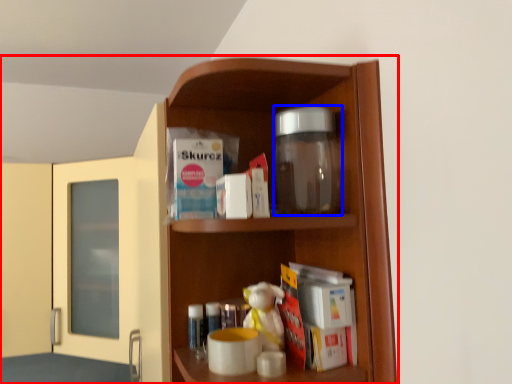
Question: Which object is closer to the camera taking this photo, cupboard (highlighted by a red box) or glass jar (highlighted by a blue box)?

Choices:
 (A) cupboard
 (B) glass jar

Answer: (B)